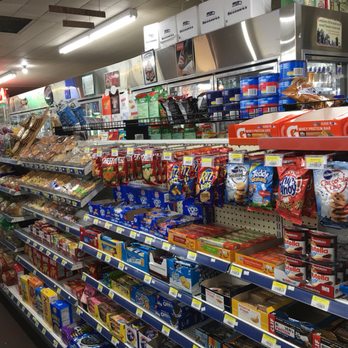
The height and width of the screenshot is (348, 348). Identify the location of top of refrigerator doors. (227, 78), (192, 87).